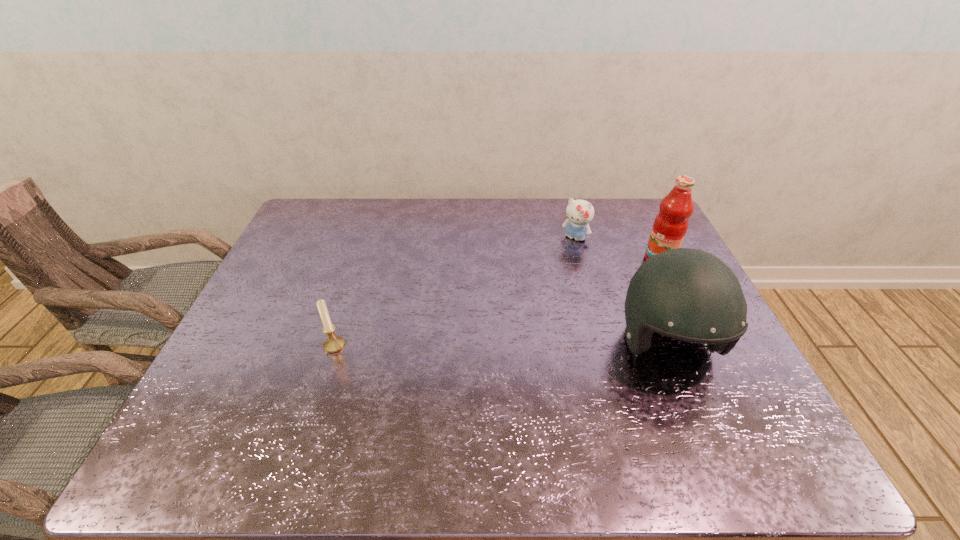
Locate an element on the screen. Image resolution: width=960 pixels, height=540 pixels. free point located on the front label of the fruit juice is located at coordinates (585, 302).

The height and width of the screenshot is (540, 960). Find the location of `free point located on the front label of the fruit juice`. free point located on the front label of the fruit juice is located at coordinates (553, 320).

This screenshot has height=540, width=960. In order to click on object at the far edge in this screenshot , I will do `click(579, 213)`.

Identify the location of object that is at the near edge. Image resolution: width=960 pixels, height=540 pixels. (687, 294).

Find the location of a particular element. This screenshot has height=540, width=960. football helmet that is at the right edge is located at coordinates (687, 294).

Locate an element on the screen. Image resolution: width=960 pixels, height=540 pixels. fruit juice that is positioned at the right edge is located at coordinates (670, 226).

Locate an element on the screen. This screenshot has height=540, width=960. object present at the near right corner is located at coordinates (687, 294).

In the image, there is a desktop. What are the coordinates of `vacant space at the far edge` in the screenshot? It's located at (495, 200).

Where is `vacant area at the near edge of the desktop`? vacant area at the near edge of the desktop is located at coordinates (401, 407).

Locate an element on the screen. free space at the left edge is located at coordinates (264, 367).